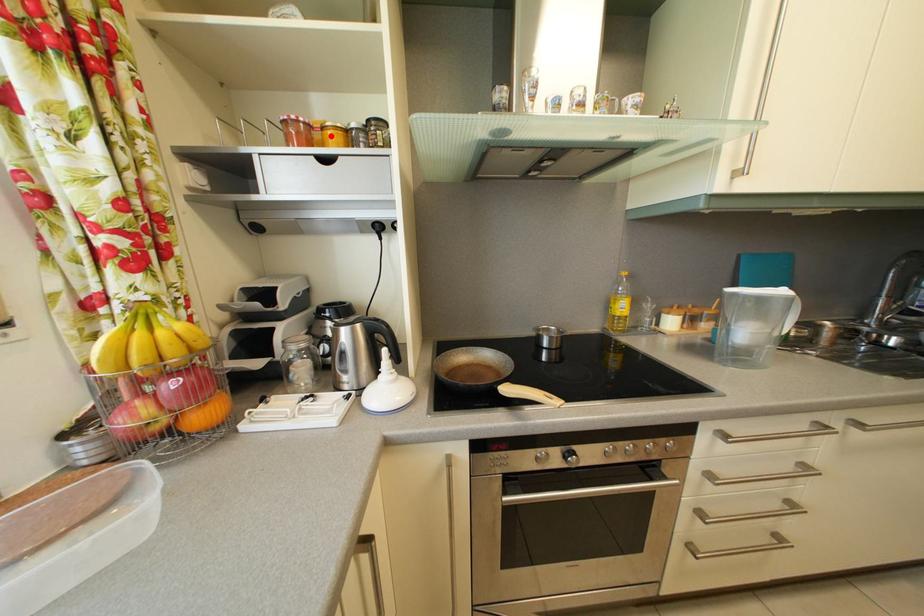
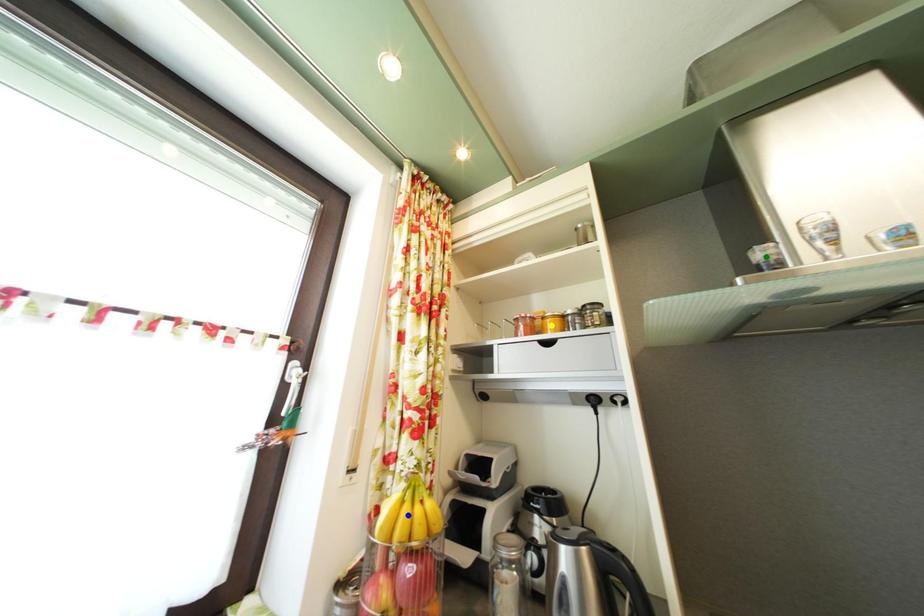
Question: I am providing you with two images of the same scene from different viewpoints. A red point is marked on the first image. You are given multiple points on the second image. Which mark in image 2 goes with the point in image 1?

Choices:
 (A) green point
 (B) yellow point
 (C) blue point

Answer: (B)